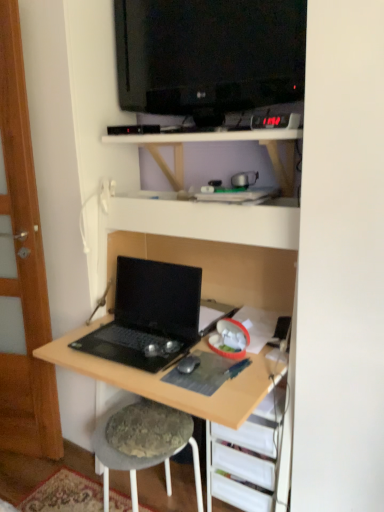
Question: Is black glossy television at upper center located outside transparent wood door at left?

Choices:
 (A) yes
 (B) no

Answer: (A)

Question: Considering the relative sizes of black glossy television at upper center and transparent wood door at left in the image provided, is black glossy television at upper center bigger than transparent wood door at left?

Choices:
 (A) yes
 (B) no

Answer: (B)

Question: Considering the relative sizes of black glossy television at upper center and transparent wood door at left in the image provided, is black glossy television at upper center taller than transparent wood door at left?

Choices:
 (A) yes
 (B) no

Answer: (B)

Question: Is the depth of black glossy television at upper center greater than that of transparent wood door at left?

Choices:
 (A) yes
 (B) no

Answer: (B)

Question: From a real-world perspective, is black glossy television at upper center located beneath transparent wood door at left?

Choices:
 (A) no
 (B) yes

Answer: (A)

Question: From the image's perspective, is black matte laptop at lower left positioned above or below transparent wood door at left?

Choices:
 (A) below
 (B) above

Answer: (A)

Question: In the image, is black matte laptop at lower left on the left side or the right side of transparent wood door at left?

Choices:
 (A) left
 (B) right

Answer: (B)

Question: From a real-world perspective, is black matte laptop at lower left positioned above or below transparent wood door at left?

Choices:
 (A) below
 (B) above

Answer: (A)

Question: Considering their positions, is black matte laptop at lower left located in front of or behind transparent wood door at left?

Choices:
 (A) behind
 (B) front

Answer: (B)

Question: Does point (230, 486) appear closer or farther from the camera than point (185, 358)?

Choices:
 (A) farther
 (B) closer

Answer: (A)

Question: From a real-world perspective, is wooden desk at lower right, the first shelf from the bottom, above or below black matte mouse at center?

Choices:
 (A) below
 (B) above

Answer: (A)

Question: Is wooden desk at lower right, the first shelf from the bottom, wider or thinner than black matte mouse at center?

Choices:
 (A) wide
 (B) thin

Answer: (A)

Question: Considering their positions, is wooden desk at lower right, the second shelf from the top, located in front of or behind black matte mouse at center?

Choices:
 (A) front
 (B) behind

Answer: (B)

Question: From the image's perspective, is textured gray stool at lower center above or below transparent wood door at left?

Choices:
 (A) below
 (B) above

Answer: (A)

Question: Is point (137, 442) closer or farther from the camera than point (33, 328)?

Choices:
 (A) farther
 (B) closer

Answer: (B)